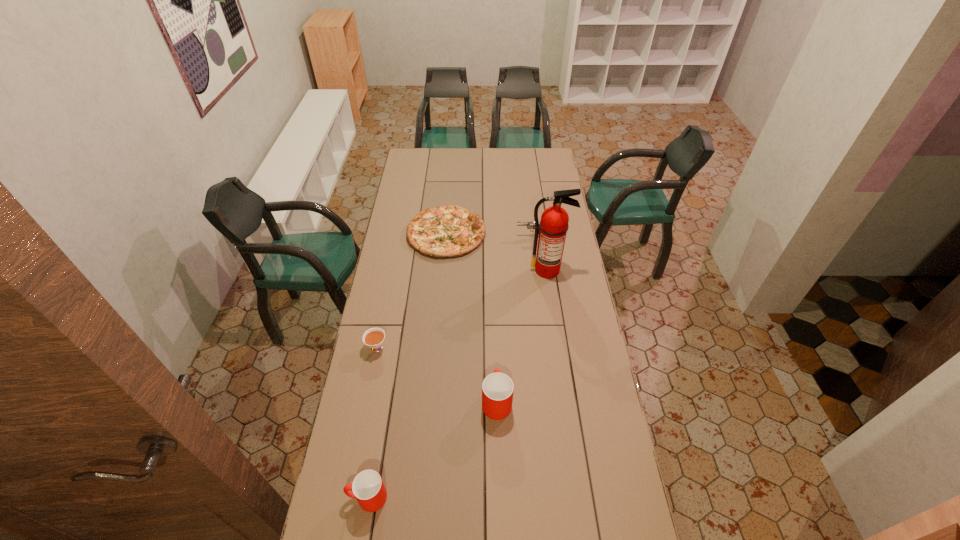
Image resolution: width=960 pixels, height=540 pixels. Find the location of `free location at the far right corner of the desktop`. free location at the far right corner of the desktop is located at coordinates (547, 152).

This screenshot has width=960, height=540. Find the location of `free space that is in between the fire extinguisher and the pizza`. free space that is in between the fire extinguisher and the pizza is located at coordinates (497, 252).

Where is `free spot between the pizza and the nearest object`? free spot between the pizza and the nearest object is located at coordinates (407, 366).

In order to click on vacant area that lies between the fifth shortest object and the pizza in this screenshot , I will do `click(471, 317)`.

At what (x,y) coordinates should I click in order to perform the action: click on vacant point located between the fourth nearest object and the teacup. Please return your answer as a coordinate pair (x, y). Looking at the image, I should click on (462, 309).

The width and height of the screenshot is (960, 540). Identify the location of free space between the fifth shortest object and the left cup. (432, 449).

The width and height of the screenshot is (960, 540). In order to click on vacant point located between the shorter cup and the third shortest object in this screenshot , I will do `click(449, 367)`.

This screenshot has height=540, width=960. Identify the location of unoccupied position between the fourth tallest object and the shortest object. (489, 235).

You are a GUI agent. You are given a task and a screenshot of the screen. Output one action in this format:
    pyautogui.click(x=<x>, y=<y>)
    Task: Click on the blank region between the nearer cup and the farther cup
    This screenshot has height=540, width=960.
    Given the screenshot: What is the action you would take?
    pyautogui.click(x=432, y=449)

Identify the location of object that is the closest to the pizza. Image resolution: width=960 pixels, height=540 pixels. (530, 225).